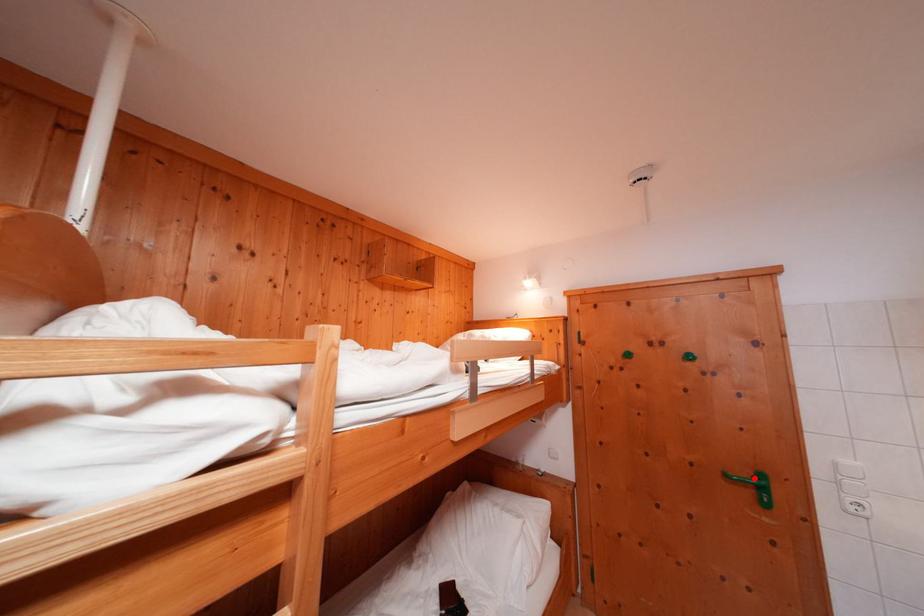
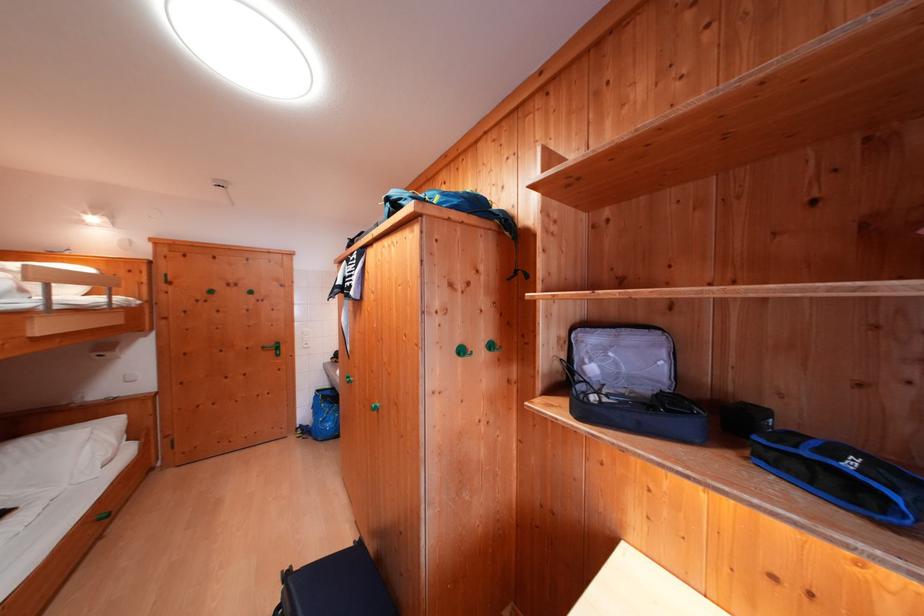
Find the pixel in the second image that matches the highlighted location in the first image.

(280, 349)